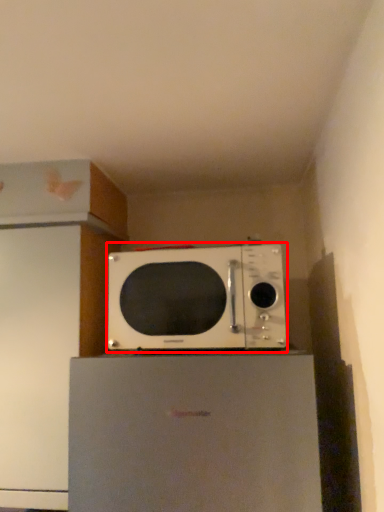
Question: From the image, what is the correct spatial relationship of microwave oven (annotated by the red box) in relation to appliance?

Choices:
 (A) left
 (B) right

Answer: (A)